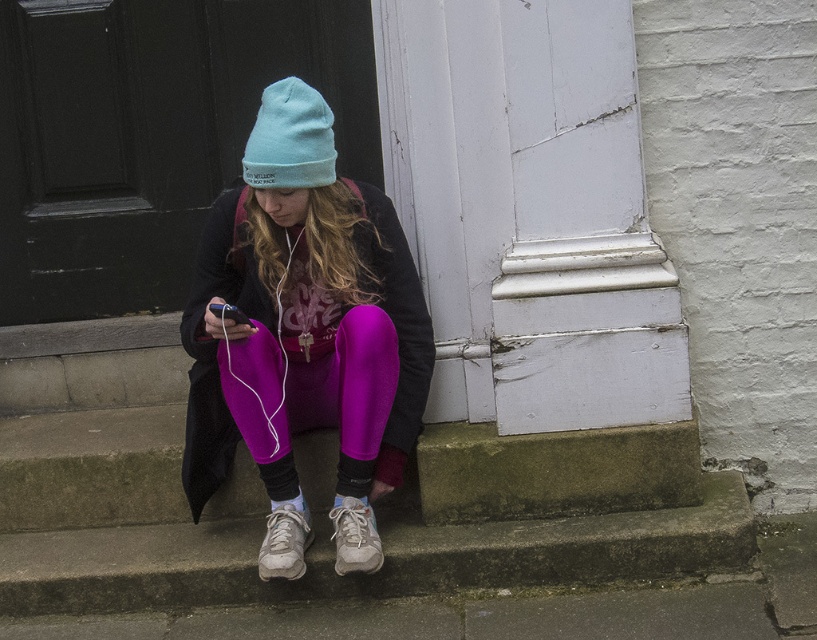
Question: Estimate the real-world distances between objects in this image. Which object is farther from the white knit sock at lower center?

Choices:
 (A) purple fleece leggings at center
 (B) black knit sock at lower center
 (C) white leather sneaker at lower center

Answer: (A)

Question: Which object appears farthest from the camera in this image?

Choices:
 (A) white leather sneaker at lower center
 (B) purple fleece pants at center
 (C) purple fleece leggings at center

Answer: (A)

Question: Is light blue knit beanie at center positioned before white knit sock at lower center?

Choices:
 (A) yes
 (B) no

Answer: (A)

Question: Can you confirm if purple fleece pants at center is positioned to the left of black knit sock at lower center?

Choices:
 (A) yes
 (B) no

Answer: (A)

Question: Among these points, which one is farthest from the camera?

Choices:
 (A) (259, 140)
 (B) (271, 504)

Answer: (B)

Question: Does concrete stairs at center appear on the right side of purple fleece leggings at center?

Choices:
 (A) yes
 (B) no

Answer: (A)